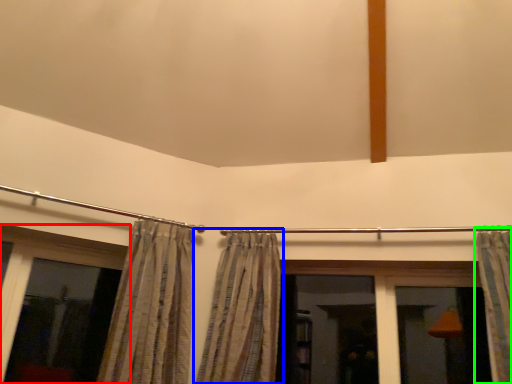
Question: Considering the real-world distances, which object is farthest from window (highlighted by a red box)? curtain (highlighted by a blue box) or curtain (highlighted by a green box)?

Choices:
 (A) curtain
 (B) curtain

Answer: (B)